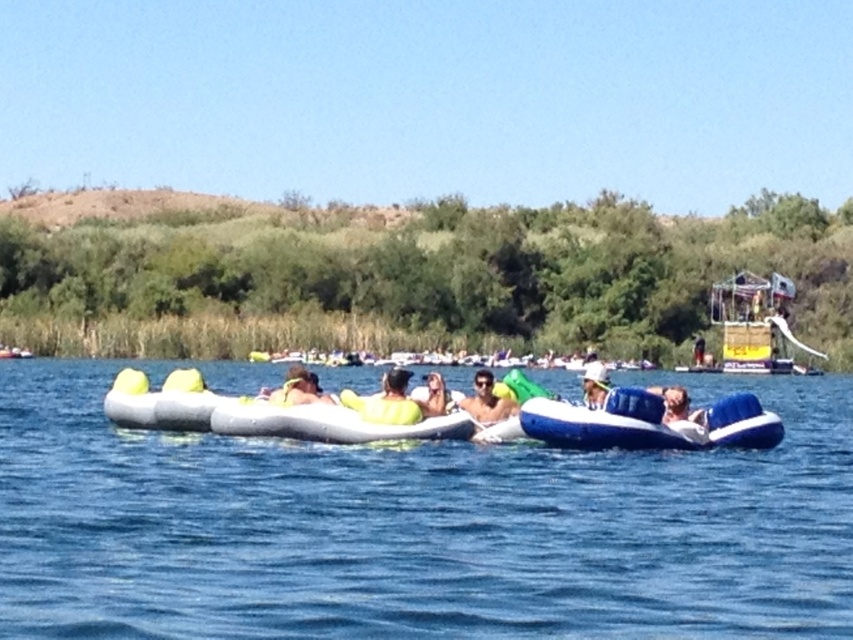
Consider the image. Is inflatable raft at center behind blue inflatable raft at center?

No, inflatable raft at center is in front of blue inflatable raft at center.

Is point (421, 625) positioned before point (573, 413)?

That is True.

Locate an element on the screen. This screenshot has width=853, height=640. inflatable raft at center is located at coordinates (416, 528).

Is inflatable raft at center bigger than matte yellow life vest at center?

Yes, inflatable raft at center is bigger than matte yellow life vest at center.

Between point (848, 433) and point (502, 413), which one is positioned in front?

Positioned in front is point (502, 413).

At what (x,y) coordinates should I click in order to perform the action: click on inflatable raft at center. Please return your answer as a coordinate pair (x, y). This screenshot has width=853, height=640. Looking at the image, I should click on click(x=416, y=528).

Is matte yellow life vest at center taller than light blue fabric float at center?

Indeed, matte yellow life vest at center has a greater height compared to light blue fabric float at center.

Who is more forward, (466, 412) or (689, 413)?

Positioned in front is point (466, 412).

Identify the location of matte yellow life vest at center. click(x=486, y=401).